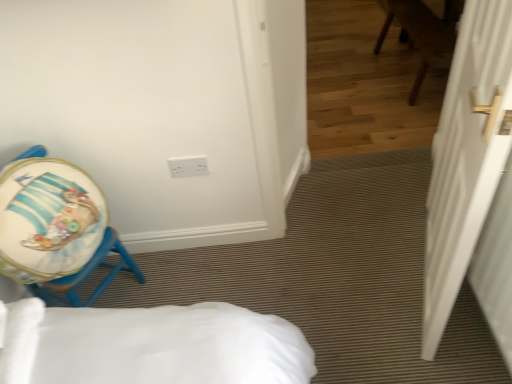
This screenshot has width=512, height=384. Find the location of `vacant space to the left of white matte door at right`. vacant space to the left of white matte door at right is located at coordinates (347, 290).